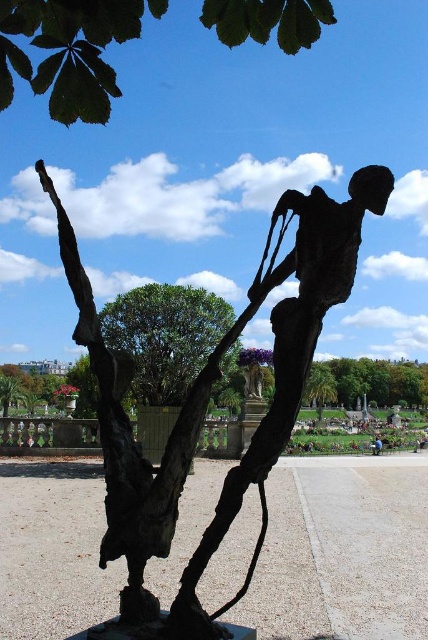
You are an artist planning to paint the sculpture scene. You need to decide whether to include both the green leafy tree at upper center and the blue fabric person at center in your painting. Considering their sizes, which one should you make larger to accurately represent their actual sizes?

The green leafy tree at upper center should be made larger than the blue fabric person at center because it is much taller as stated in the description.

You are standing in front of the sculpture and want to place a small flower pot between the two points, point (133, 570) and point (377, 451). Can you determine which direction you should place it to ensure it is between them?

Since point (133, 570) is in front of point (377, 451), you should place the flower pot between them by positioning it closer to the front point (133, 570) so it stays between both points.